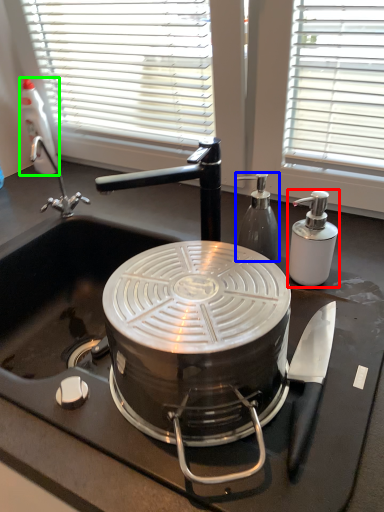
Question: Which is nearer to the kitchen appliance (highlighted by a red box)? kitchen appliance (highlighted by a blue box) or bottle (highlighted by a green box).

Choices:
 (A) kitchen appliance
 (B) bottle

Answer: (A)